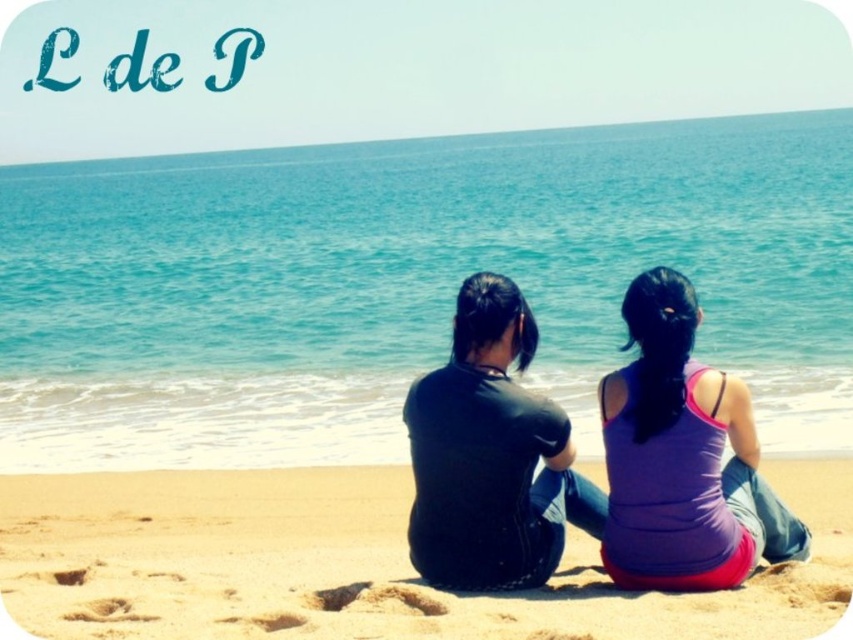
Does purple fabric tank top at center appear on the left side of black matte shirt at center?

Incorrect, purple fabric tank top at center is not on the left side of black matte shirt at center.

Can you confirm if purple fabric tank top at center is wider than black matte shirt at center?

Yes, purple fabric tank top at center is wider than black matte shirt at center.

Find the location of a particular element. purple fabric tank top at center is located at coordinates (x=682, y=458).

Who is taller, sandy yellow sand at center or purple fabric tank top at center?

Standing taller between the two is purple fabric tank top at center.

Who is positioned more to the left, sandy yellow sand at center or purple fabric tank top at center?

sandy yellow sand at center

Is point (260, 563) positioned in front of point (712, 493)?

No, (260, 563) is further to viewer.

Where is `sandy yellow sand at center`? Image resolution: width=853 pixels, height=640 pixels. sandy yellow sand at center is located at coordinates (354, 563).

Which is more to the left, sandy yellow sand at center or black matte shirt at center?

sandy yellow sand at center

Between point (537, 614) and point (476, 355), which one is positioned behind?

The point (476, 355) is more distant.

Where is `sandy yellow sand at center`? sandy yellow sand at center is located at coordinates (354, 563).